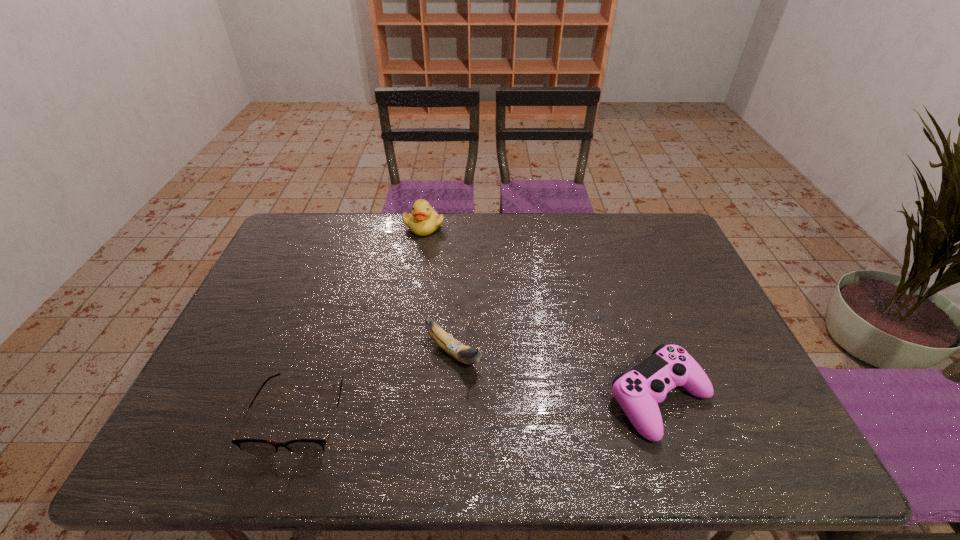
At what (x,y) coordinates should I click in order to perform the action: click on vacant spot on the desktop that is between the shortest object and the control and is positioned at the stem of the banana. Please return your answer as a coordinate pair (x, y). This screenshot has height=540, width=960. Looking at the image, I should click on (518, 406).

Locate an element on the screen. free space on the desktop that is between the spectacles and the third tallest object and is positioned on the front-facing side of the duckling is located at coordinates (533, 405).